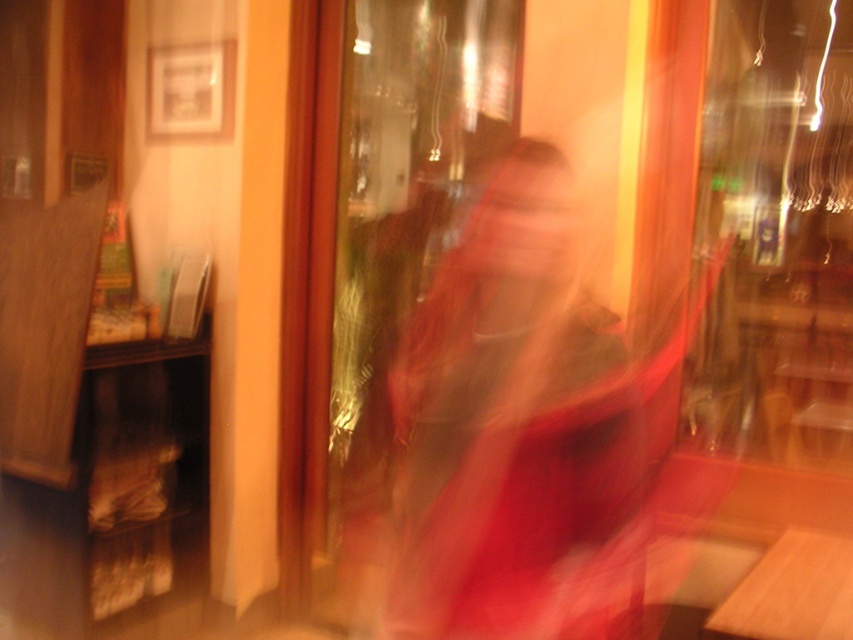
Is silky red dress at center shorter than transparent glass door at center?

Correct, silky red dress at center is not as tall as transparent glass door at center.

Who is positioned more to the left, silky red dress at center or transparent glass door at center?

transparent glass door at center

Is point (386, 474) closer to camera compared to point (408, 93)?

No.

The width and height of the screenshot is (853, 640). What are the coordinates of `silky red dress at center` in the screenshot? It's located at (511, 435).

Is transparent glass shop window at upper right below transparent glass door at center?

Incorrect, transparent glass shop window at upper right is not positioned below transparent glass door at center.

Which of these two, transparent glass shop window at upper right or transparent glass door at center, stands taller?

transparent glass door at center is taller.

What do you see at coordinates (776, 236) in the screenshot?
I see `transparent glass shop window at upper right` at bounding box center [776, 236].

Locate an element on the screen. This screenshot has height=640, width=853. transparent glass shop window at upper right is located at coordinates (776, 236).

Describe the element at coordinates (511, 435) in the screenshot. I see `silky red dress at center` at that location.

Who is shorter, silky red dress at center or transparent glass shop window at upper right?

silky red dress at center

Where is `silky red dress at center`? silky red dress at center is located at coordinates (511, 435).